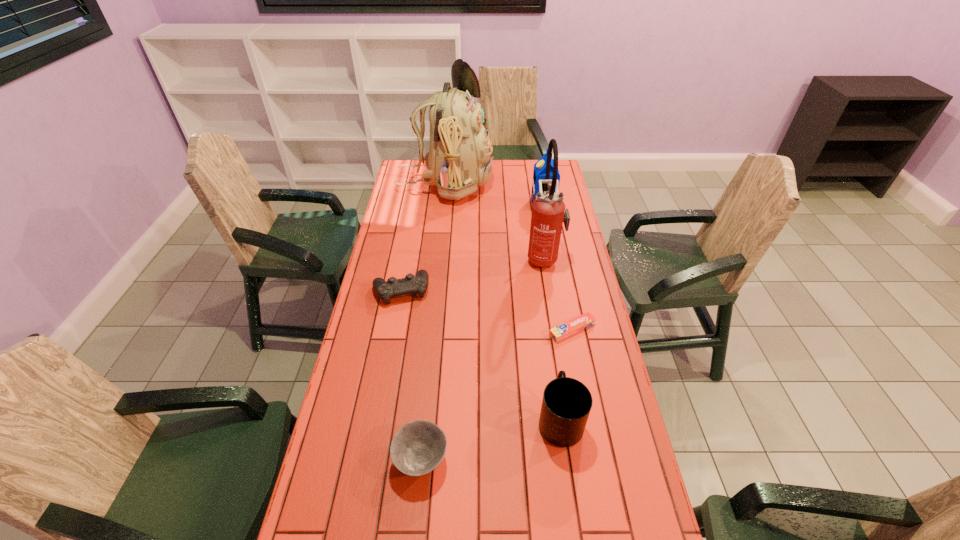
At what (x,y) coordinates should I click in order to perform the action: click on vacant space located 0.400m on the front of the shortest object. Please return your answer as a coordinate pair (x, y). The width and height of the screenshot is (960, 540). Looking at the image, I should click on (599, 465).

I want to click on object that is positioned at the far edge, so 459,160.

Where is `backpack that is at the left edge`? This screenshot has width=960, height=540. backpack that is at the left edge is located at coordinates (459, 160).

You are a GUI agent. You are given a task and a screenshot of the screen. Output one action in this format:
    pyautogui.click(x=<x>, y=<y>)
    Task: Click on the control situated at the left edge
    The image size is (960, 540).
    Given the screenshot: What is the action you would take?
    pyautogui.click(x=411, y=284)

Locate an element on the screen. fire extinguisher at the right edge is located at coordinates (548, 209).

Where is `carton present at the right edge`? The image size is (960, 540). carton present at the right edge is located at coordinates (539, 173).

Find the location of a particular element. The image size is (960, 540). mug present at the right edge is located at coordinates (566, 404).

The width and height of the screenshot is (960, 540). What are the coordinates of `toothpaste situated at the right edge` in the screenshot? It's located at (571, 327).

This screenshot has height=540, width=960. What are the coordinates of `object located in the far left corner section of the desktop` in the screenshot? It's located at (459, 160).

Where is `free space at the far edge of the desktop`? free space at the far edge of the desktop is located at coordinates (502, 181).